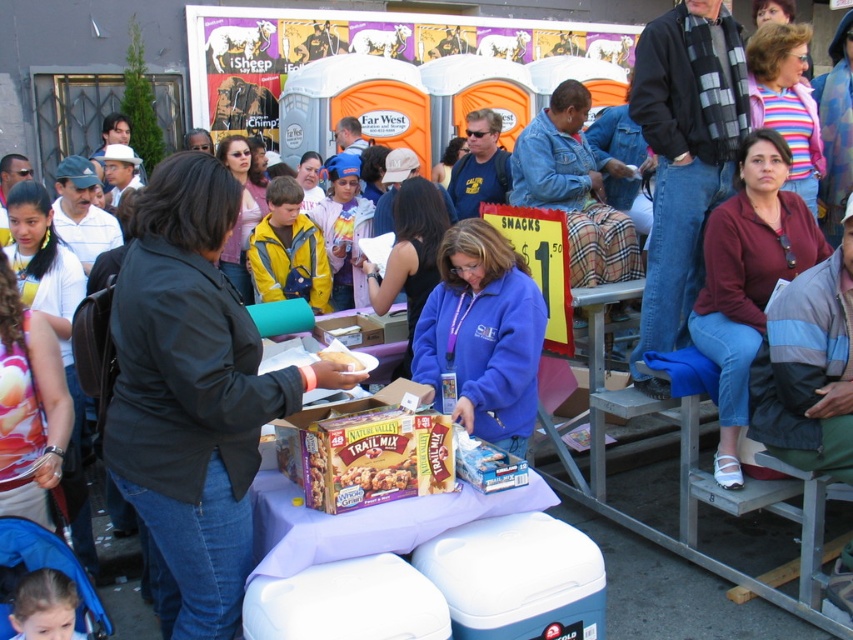
Question: Where is black matte jacket at center located in relation to maroon fabric shirt at right in the image?

Choices:
 (A) below
 (B) above

Answer: (A)

Question: Which object is farther from the camera taking this photo?

Choices:
 (A) chocolate textured bar at center
 (B) blue fabric stroller at lower left

Answer: (A)

Question: Where is black matte jacket at center located in relation to blue fleece jacket at center in the image?

Choices:
 (A) above
 (B) below

Answer: (B)

Question: Which object appears farthest from the camera in this image?

Choices:
 (A) blue fabric stroller at lower left
 (B) blue fleece jacket at center
 (C) black matte jacket at center

Answer: (B)

Question: Is black matte jacket at center below blue fabric stroller at lower left?

Choices:
 (A) no
 (B) yes

Answer: (A)

Question: Which object is positioned farthest from the maroon fabric shirt at right?

Choices:
 (A) blue fleece jacket at center
 (B) black matte jacket at center
 (C) chocolate textured bar at center
 (D) blue fabric stroller at lower left

Answer: (D)